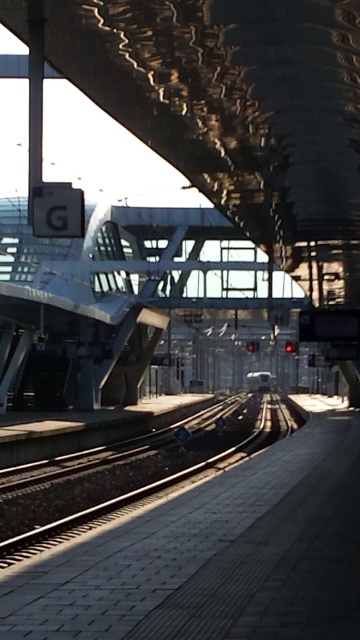
Question: Which point is farther from the camera taking this photo?

Choices:
 (A) (258, 376)
 (B) (263, 432)

Answer: (A)

Question: Which point appears farthest from the camera in this image?

Choices:
 (A) (271, 385)
 (B) (118, 500)

Answer: (A)

Question: Can you confirm if smooth concrete track at center is positioned to the right of metallic silver train at center?

Choices:
 (A) yes
 (B) no

Answer: (B)

Question: Is smooth concrete track at center to the left of metallic silver train at center from the viewer's perspective?

Choices:
 (A) yes
 (B) no

Answer: (A)

Question: Does smooth concrete track at center come behind metallic silver train at center?

Choices:
 (A) yes
 (B) no

Answer: (B)